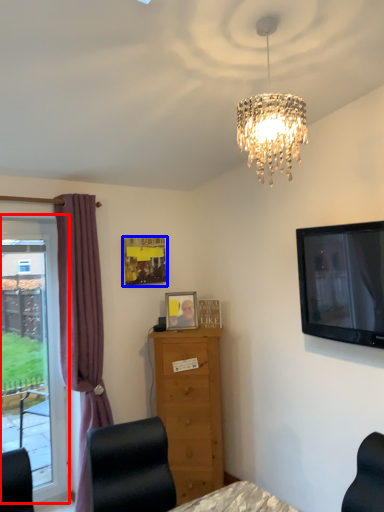
Question: Which object is further to the camera taking this photo, window (highlighted by a red box) or picture frame (highlighted by a blue box)?

Choices:
 (A) window
 (B) picture frame

Answer: (B)